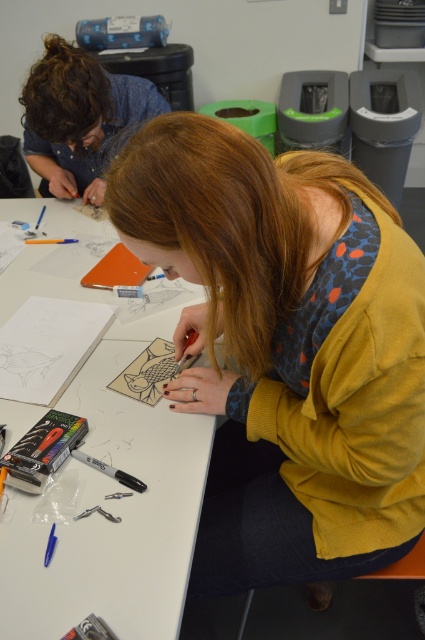
The height and width of the screenshot is (640, 425). Identify the location of matte yellow sweater at center. (286, 348).

Can you confirm if matte yellow sweater at center is thinner than white paper at center?

Yes, matte yellow sweater at center is thinner than white paper at center.

Is point (291, 378) farther from camera compared to point (118, 541)?

Yes, it is behind point (118, 541).

What are the coordinates of `matte yellow sweater at center` in the screenshot? It's located at (286, 348).

Does point (79, 547) come farther from viewer compared to point (54, 112)?

That is False.

Between white paper at center and curly brown hair at upper left, which one is positioned lower?

white paper at center

I want to click on white paper at center, so click(104, 461).

Which is more to the right, matte yellow sweater at center or curly brown hair at upper left?

matte yellow sweater at center is more to the right.

Does matte yellow sweater at center have a lesser height compared to curly brown hair at upper left?

Incorrect, matte yellow sweater at center's height does not fall short of curly brown hair at upper left's.

Which is behind, point (265, 568) or point (65, 65)?

Point (65, 65)

What are the coordinates of `matte yellow sweater at center` in the screenshot? It's located at (286, 348).